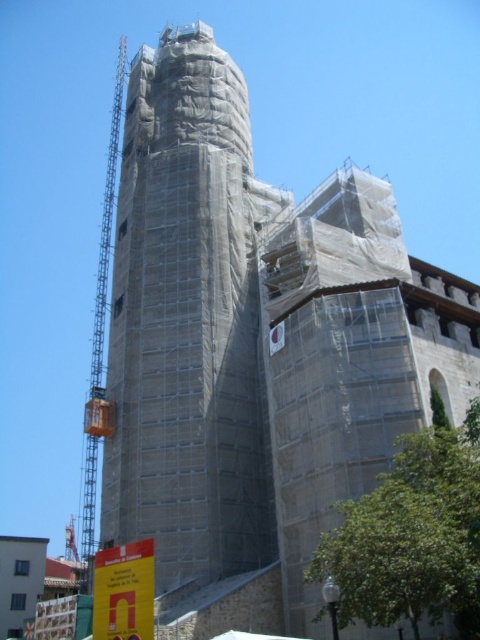
You are standing in front of the gray concrete tower at center and want to see the orange metallic crane at left. Is the crane fully visible from your current position?

The gray concrete tower at center is in front of the orange metallic crane at left, so the crane is partially or fully blocked by the tower and may not be fully visible.

You are an inspector needing to assess the structural integrity of the gray concrete tower at center and the orange metallic crane at left. Which object has a narrower width?

The gray concrete tower at center has a narrower width than the orange metallic crane at left.

You are a construction worker standing at the base of the gray concrete tower at center and the orange metallic crane at left. Which object is closer to you?

The gray concrete tower at center is closer to you because it is positioned over the orange metallic crane at left, meaning it is in front of the crane.